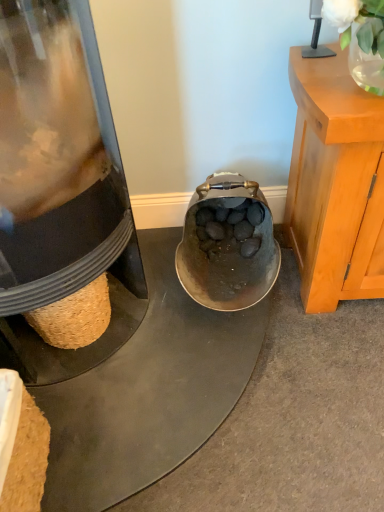
Question: Is translucent glass vase at upper right inside or outside of matte black kettle at lower left?

Choices:
 (A) outside
 (B) inside

Answer: (A)

Question: Is translucent glass vase at upper right taller or shorter than matte black kettle at lower left?

Choices:
 (A) short
 (B) tall

Answer: (A)

Question: Considering their positions, is translucent glass vase at upper right located in front of or behind matte black kettle at lower left?

Choices:
 (A) behind
 (B) front

Answer: (A)

Question: From the image's perspective, relative to translucent glass vase at upper right, is matte black kettle at lower left above or below?

Choices:
 (A) above
 (B) below

Answer: (B)

Question: From their relative heights in the image, would you say matte black kettle at lower left is taller or shorter than translucent glass vase at upper right?

Choices:
 (A) tall
 (B) short

Answer: (A)

Question: Is matte black kettle at lower left in front of or behind translucent glass vase at upper right in the image?

Choices:
 (A) behind
 (B) front

Answer: (B)

Question: Is point (99, 261) closer or farther from the camera than point (350, 29)?

Choices:
 (A) farther
 (B) closer

Answer: (A)